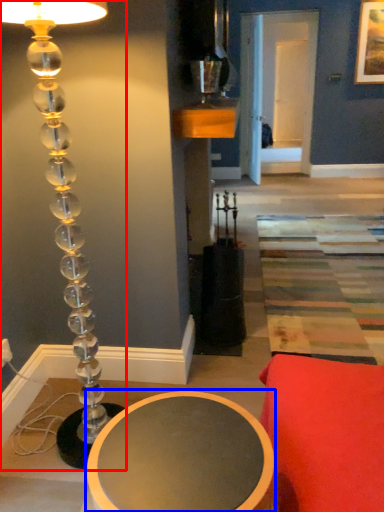
Question: Which object is further to the camera taking this photo, lamp (highlighted by a red box) or table (highlighted by a blue box)?

Choices:
 (A) lamp
 (B) table

Answer: (A)